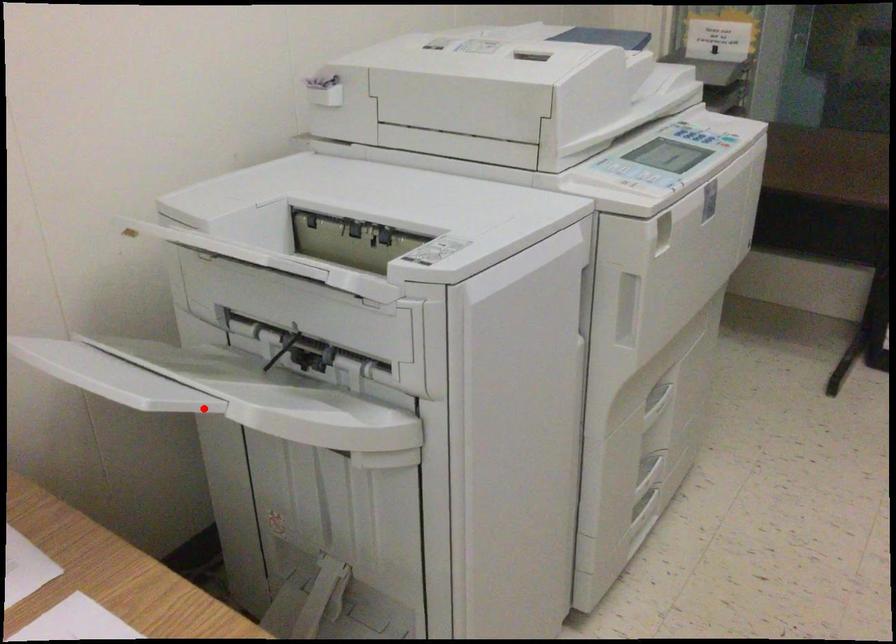
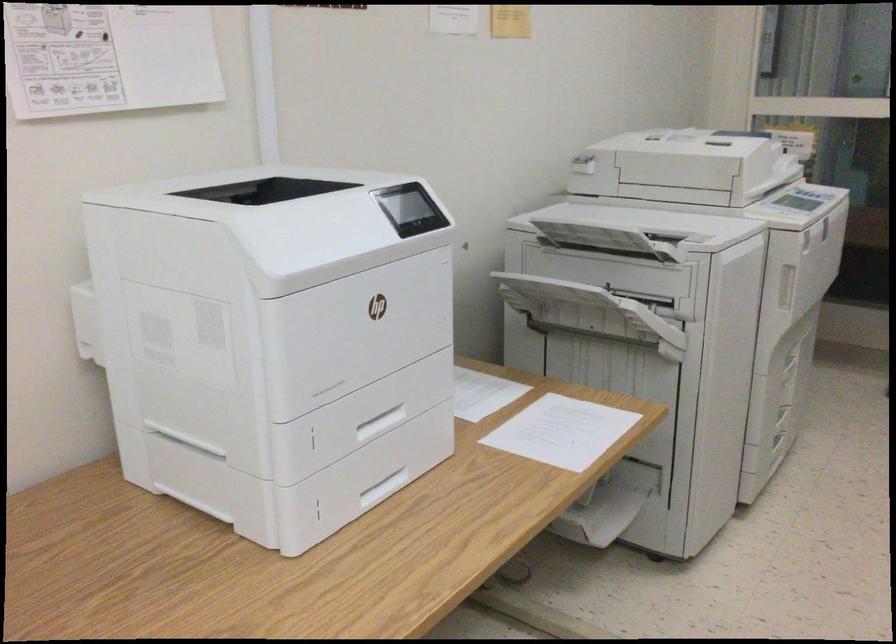
The point at the highlighted location is marked in the first image. Where is the corresponding point in the second image?

(601, 301)